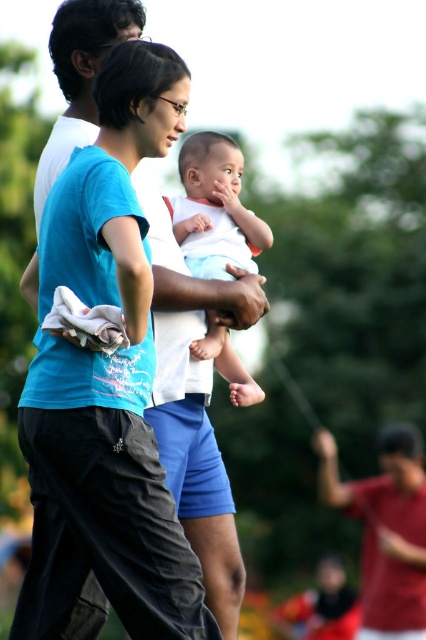
Is blue cotton shirt at center wider than white soft baby at center?

Yes.

Does blue cotton shirt at center have a greater height compared to white soft baby at center?

Correct, blue cotton shirt at center is much taller as white soft baby at center.

Is point (91, 147) positioned before point (241, 164)?

That is True.

Locate an element on the screen. The image size is (426, 640). blue cotton shirt at center is located at coordinates (115, 360).

From the picture: Can you confirm if blue cotton shirt at center is positioned to the left of red shirt at center?

Yes, blue cotton shirt at center is to the left of red shirt at center.

Between blue cotton shirt at center and red shirt at center, which one has more height?

blue cotton shirt at center is taller.

Is point (91, 458) closer to viewer compared to point (416, 525)?

Yes, point (91, 458) is in front of point (416, 525).

Identify the location of blue cotton shirt at center. (115, 360).

Does red shirt at center have a lesser width compared to white soft baby at center?

No.

Does point (409, 436) come farther from viewer compared to point (227, 182)?

Yes, it is behind point (227, 182).

Image resolution: width=426 pixels, height=640 pixels. In order to click on red shirt at center in this screenshot , I will do `click(385, 529)`.